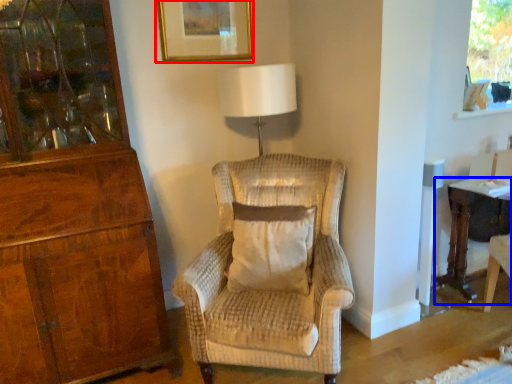
Question: Among these objects, which one is nearest to the camera, picture frame (highlighted by a red box) or desk (highlighted by a blue box)?

Choices:
 (A) picture frame
 (B) desk

Answer: (B)